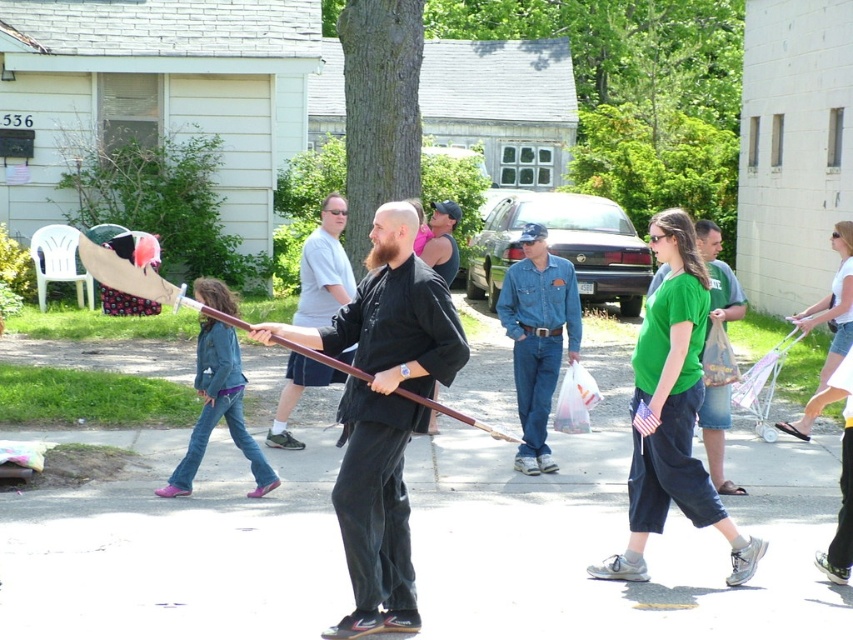
Which is more to the right, matte black shirt at center or green matte shirt at center?

green matte shirt at center

Between matte black shirt at center and green matte shirt at center, which one has less height?

With less height is green matte shirt at center.

Locate an element on the screen. matte black shirt at center is located at coordinates (323, 268).

Does point (274, 326) come farther from viewer compared to point (279, 438)?

No, (274, 326) is closer to viewer.

Does black matte sword at center come behind matte black shirt at center?

No.

Is point (403, 266) behind point (312, 374)?

No, (403, 266) is closer to viewer.

What are the coordinates of `black matte sword at center` in the screenshot? It's located at (383, 412).

Which is behind, point (409, 292) or point (711, 268)?

The point (711, 268) is more distant.

Who is more forward, (397, 538) or (715, 408)?

Point (397, 538) is more forward.

Who is more distant from viewer, (335, 516) or (744, 308)?

Point (744, 308)

This screenshot has height=640, width=853. What are the coordinates of `black matte sword at center` in the screenshot? It's located at (383, 412).